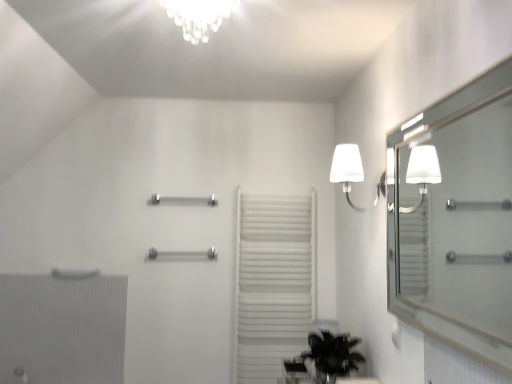
Question: Considering the relative positions of white matte towel rack at center and polished chrome towel bar at center, acting as the second towel bar starting from the top, in the image provided, is white matte towel rack at center to the left or to the right of polished chrome towel bar at center, acting as the second towel bar starting from the top,?

Choices:
 (A) right
 (B) left

Answer: (A)

Question: Considering the positions of white matte towel rack at center and polished chrome towel bar at center, arranged as the 1th towel bar when ordered from the bottom, in the image, is white matte towel rack at center bigger or smaller than polished chrome towel bar at center, arranged as the 1th towel bar when ordered from the bottom,?

Choices:
 (A) small
 (B) big

Answer: (B)

Question: Estimate the real-world distances between objects in this image. Which object is farther from the silver/metallic mirror at right?

Choices:
 (A) green leafy plant at lower center
 (B) white fabric lamp at upper right
 (C) polished chrome towel bar at center, the first towel bar viewed from the top
 (D) polished chrome towel bar at center, arranged as the 1th towel bar when ordered from the bottom
 (E) white textured radiator at lower left

Answer: (E)

Question: Considering the real-world distances, which object is closest to the polished chrome towel bar at center, arranged as the 1th towel bar when ordered from the bottom?

Choices:
 (A) polished chrome towel bar at center, the first towel bar viewed from the top
 (B) silver/metallic mirror at right
 (C) white matte towel rack at center
 (D) white fabric lamp at upper right
 (E) white textured radiator at lower left

Answer: (A)